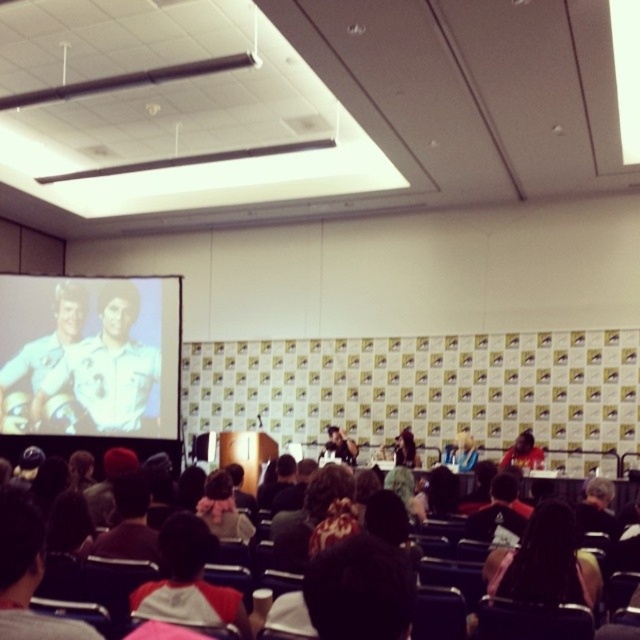
Question: Is matte white screen at upper left to the left of white cotton shirt at center from the viewer's perspective?

Choices:
 (A) yes
 (B) no

Answer: (A)

Question: Can you confirm if matte white screen at upper left is positioned to the right of white cotton shirt at center?

Choices:
 (A) yes
 (B) no

Answer: (B)

Question: Can you confirm if matte white screen at upper left is positioned to the right of white cotton shirt at center?

Choices:
 (A) yes
 (B) no

Answer: (B)